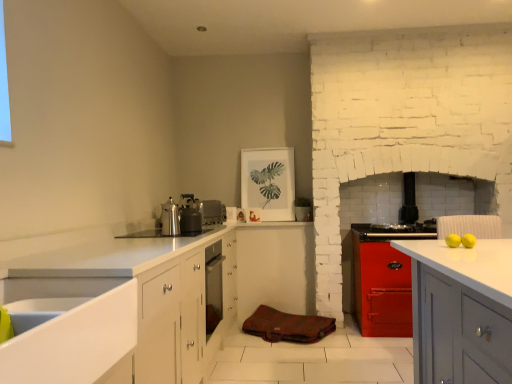
Question: In terms of size, does metallic silver kettle at upper center, arranged as the first appliance when viewed from the front, appear bigger or smaller than brown leather bag at center?

Choices:
 (A) small
 (B) big

Answer: (A)

Question: Is point (193, 223) closer or farther from the camera than point (276, 326)?

Choices:
 (A) closer
 (B) farther

Answer: (A)

Question: Which of these objects is positioned farthest from the metallic silver kettle at upper center, arranged as the first appliance when viewed from the left?

Choices:
 (A) metallic stove at center, which is the 1th appliance from back to front
 (B) white glossy sink at lower left
 (C) shiny metallic kettle at center
 (D) brown leather bag at center
 (E) satin silver toaster at center, the second appliance when ordered from back to front

Answer: (A)

Question: Estimate the real-world distances between objects in this image. Which object is closer to the satin silver toaster at center, the second appliance in the left-to-right sequence?

Choices:
 (A) white glossy sink at lower left
 (B) metallic silver kettle at upper center, arranged as the first appliance when viewed from the left
 (C) shiny metallic kettle at center
 (D) brown leather bag at center
 (E) metallic stove at center, which appears as the 3th appliance when viewed from the left

Answer: (B)